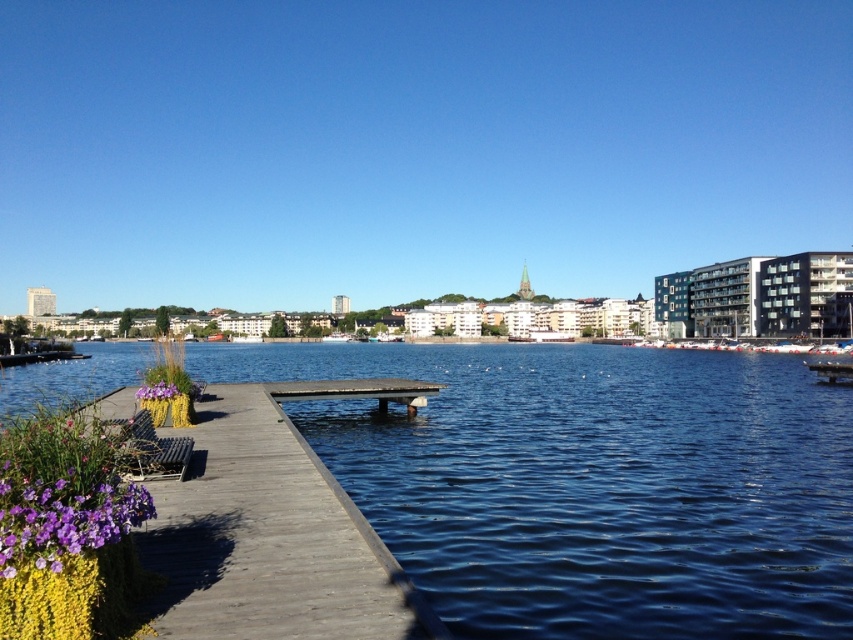
Find the location of a particular element. This screenshot has width=853, height=640. wooden dock at lower left is located at coordinates (273, 531).

Can you confirm if wooden dock at lower left is positioned below purple matte flower at lower left?

Indeed, wooden dock at lower left is positioned under purple matte flower at lower left.

Is point (198, 454) positioned after point (158, 394)?

No, (198, 454) is in front of (158, 394).

Where is `wooden dock at lower left`? Image resolution: width=853 pixels, height=640 pixels. wooden dock at lower left is located at coordinates click(273, 531).

Which is below, purple matte flowers at lower left or wooden picnic table at center?

wooden picnic table at center

Who is shorter, purple matte flowers at lower left or wooden picnic table at center?

wooden picnic table at center is shorter.

Who is more forward, [3,481] or [404,385]?

Positioned in front is point [3,481].

Find the location of a particular element. The height and width of the screenshot is (640, 853). purple matte flowers at lower left is located at coordinates (64, 520).

Which is in front, point (279, 401) or point (165, 381)?

Point (165, 381)

In order to click on wooden picnic table at center in this screenshot , I will do `click(357, 390)`.